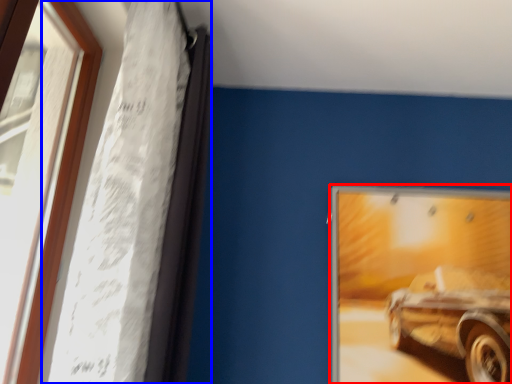
Question: Which point is closer to the camera, picture frame (highlighted by a red box) or curtain (highlighted by a blue box)?

Choices:
 (A) picture frame
 (B) curtain

Answer: (B)